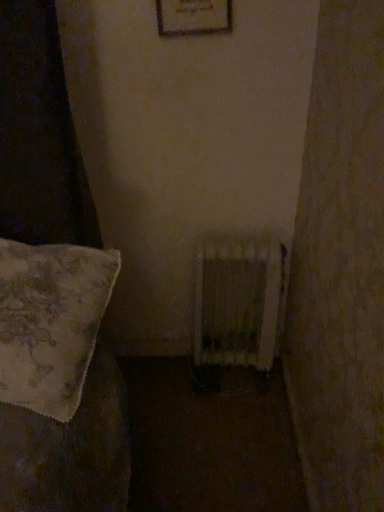
Question: In the image, is wooden framed picture at upper center positioned in front of or behind floral fabric pillow at left?

Choices:
 (A) behind
 (B) front

Answer: (A)

Question: Considering the positions of wooden framed picture at upper center and floral fabric pillow at left in the image, is wooden framed picture at upper center wider or thinner than floral fabric pillow at left?

Choices:
 (A) wide
 (B) thin

Answer: (B)

Question: Estimate the real-world distances between objects in this image. Which object is farther from the wooden radiator at center?

Choices:
 (A) floral fabric pillow at left
 (B) wooden framed picture at upper center

Answer: (B)

Question: Which object is the closest to the floral fabric pillow at left?

Choices:
 (A) wooden radiator at center
 (B) wooden framed picture at upper center

Answer: (A)